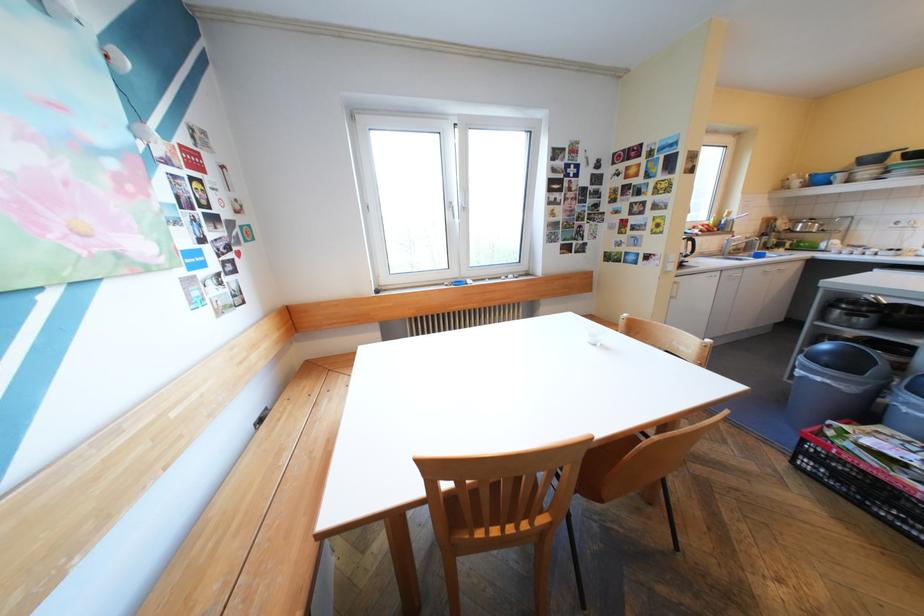
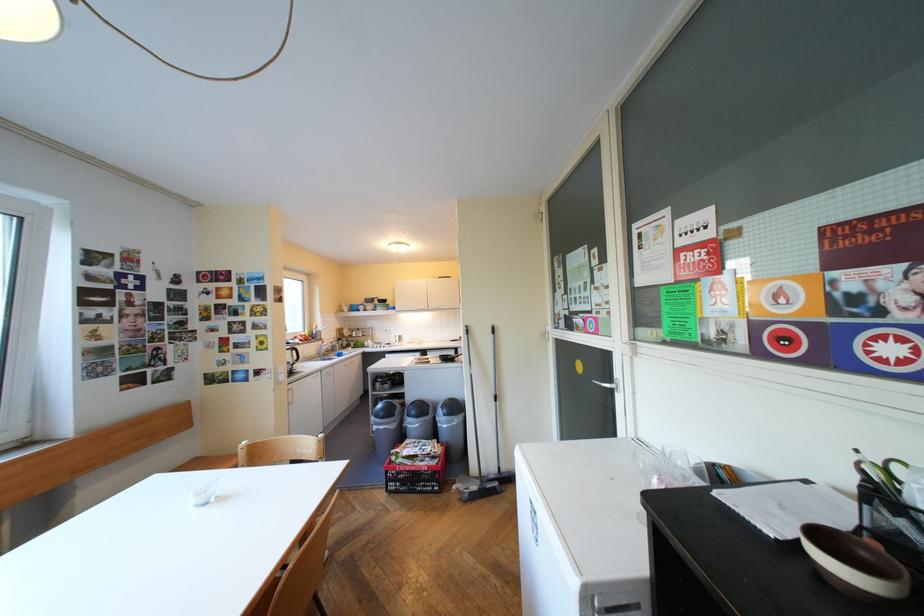
Where in the second image is the point corresponding to point 839,357 from the first image?

(394, 411)